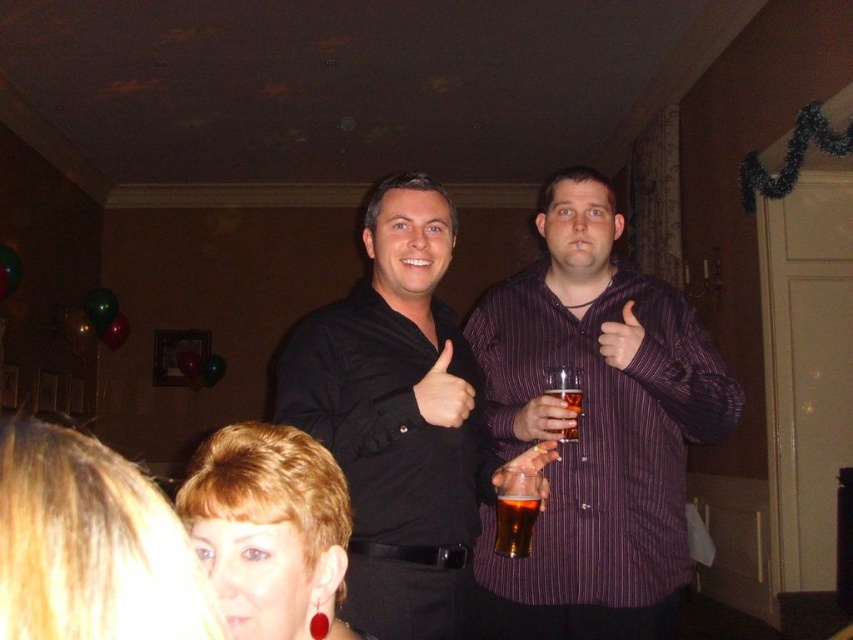
Question: Which of the following is the farthest from the observer?

Choices:
 (A) (548, 419)
 (B) (410, 513)
 (C) (563, 433)
 (D) (497, 444)

Answer: (D)

Question: Which point is closer to the camera taking this photo?

Choices:
 (A) (195, 589)
 (B) (552, 403)
 (C) (367, 445)
 (D) (566, 397)

Answer: (A)

Question: Can you confirm if blonde hair at lower left is positioned to the left of translucent glass beer at center?

Choices:
 (A) yes
 (B) no

Answer: (A)

Question: Estimate the real-world distances between objects in this image. Which object is closer to the blonde hair at lower left?

Choices:
 (A) shiny red earrings at lower left
 (B) black matte shirt at center
 (C) purple striped shirt at center

Answer: (A)

Question: Observing the image, what is the correct spatial positioning of blonde hair at lower left in reference to shiny red earrings at lower left?

Choices:
 (A) below
 (B) above

Answer: (B)

Question: Is purple striped shirt at center positioned in front of translucent plastic cup at center?

Choices:
 (A) yes
 (B) no

Answer: (A)